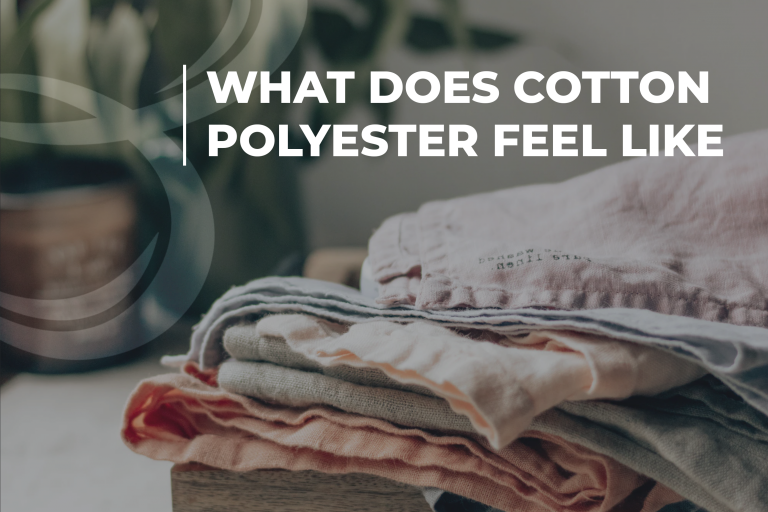
Identify the location of white counter top. (141, 480).